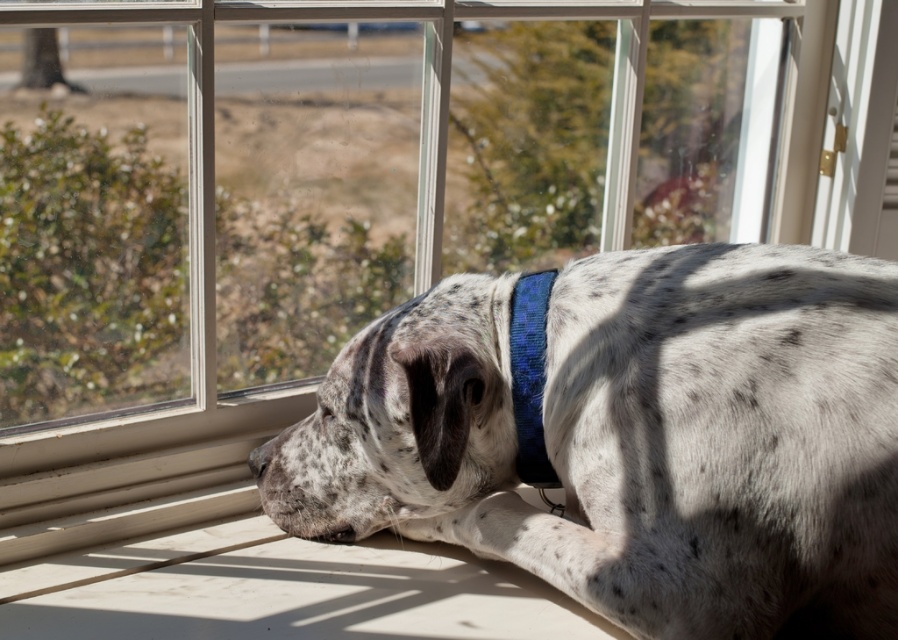
You are a photographer trying to capture the dog in the image. You want to ensure that both the speckled fur at lower center and the blue textured fabric neckband at center are visible in your shot. Based on their positions, which object should you focus on first to frame both effectively?

The blue textured fabric neckband at center is on the left side of the speckled fur at lower center. To frame both effectively, focus on the blue textured fabric neckband at center first since it is positioned to the left, allowing the speckled fur at lower center to naturally fall into the frame on the right side.